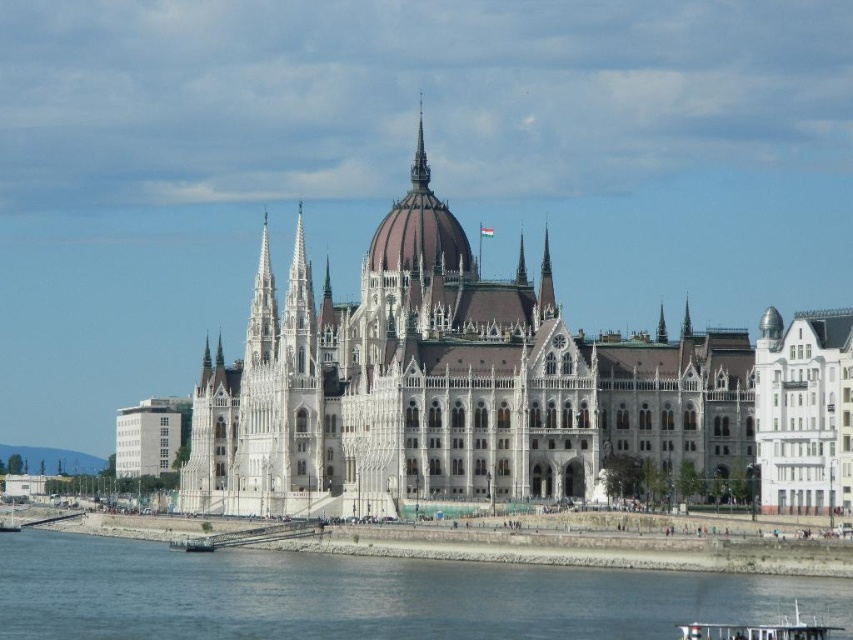
Question: Is white stone palace at center thinner than smooth silver spire at upper center?

Choices:
 (A) yes
 (B) no

Answer: (B)

Question: Which point is closer to the camera taking this photo?

Choices:
 (A) (665, 340)
 (B) (575, 593)

Answer: (B)

Question: Which object is closer to the camera taking this photo?

Choices:
 (A) white wooden boat at lower center
 (B) smooth silver spire at upper center
 (C) gray concrete river at lower center

Answer: (A)

Question: Does white stone palace at center appear over smooth silver spire at upper center?

Choices:
 (A) yes
 (B) no

Answer: (A)

Question: Can you confirm if white stone palace at center is smaller than smooth silver spire at upper center?

Choices:
 (A) no
 (B) yes

Answer: (A)

Question: Which is farther from the white stone palace at center?

Choices:
 (A) smooth silver spire at upper center
 (B) gray concrete river at lower center
 (C) white wooden boat at lower center

Answer: (C)